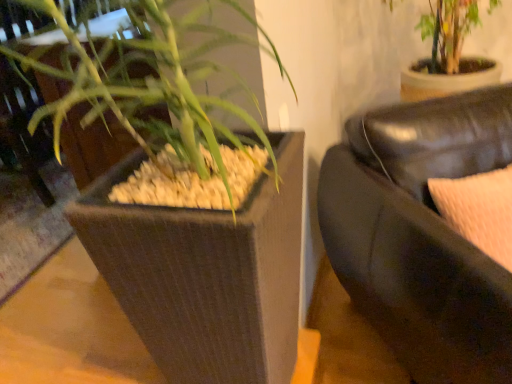
This screenshot has width=512, height=384. What are the coordinates of `brown textured planter at left` in the screenshot? It's located at (206, 274).

Describe the element at coordinates (154, 99) in the screenshot. I see `green leafy plant at upper left` at that location.

The height and width of the screenshot is (384, 512). I want to click on brown textured planter at left, so click(x=206, y=274).

From a real-world perspective, is brown textured planter at left below green leafy plant at upper left?

Yes, from a real-world perspective, brown textured planter at left is beneath green leafy plant at upper left.

Is brown textured planter at left positioned behind green leafy plant at upper left?

Yes, it is behind green leafy plant at upper left.

Is brown textured planter at left far away from green leafy plant at upper left?

No, brown textured planter at left is not far away from green leafy plant at upper left.

Is brown textured planter at left next to black leather couch at right?

No.

Does brown textured planter at left lie in front of black leather couch at right?

No, the depth of brown textured planter at left is greater than that of black leather couch at right.

Who is bigger, brown textured planter at left or black leather couch at right?

black leather couch at right is bigger.

Does point (469, 275) appear closer or farther from the camera than point (83, 202)?

Point (469, 275) is positioned closer to the camera compared to point (83, 202).

In the image, is black leather couch at right positioned in front of or behind brown textured planter at left?

Clearly, black leather couch at right is in front of brown textured planter at left.

Is black leather couch at right located outside brown textured planter at left?

Yes, black leather couch at right is located beyond the bounds of brown textured planter at left.

Considering the positions of objects black leather couch at right and brown textured planter at left in the image provided, who is more to the left, black leather couch at right or brown textured planter at left?

Positioned to the left is brown textured planter at left.

Considering the points (460, 311) and (159, 99), which point is in front, point (460, 311) or point (159, 99)?

The point (159, 99) is closer to the camera.

Is black leather couch at right oriented away from green leafy plant at upper left?

black leather couch at right does not have its back to green leafy plant at upper left.

Between black leather couch at right and green leafy plant at upper left, which one appears on the right side from the viewer's perspective?

black leather couch at right.

How many degrees apart are the facing directions of black leather couch at right and green leafy plant at upper left?

The angular difference between black leather couch at right and green leafy plant at upper left is 35.8 degrees.

You are a GUI agent. You are given a task and a screenshot of the screen. Output one action in this format:
    pyautogui.click(x=<x>, y=<y>)
    Task: Click on the flowerpot behind the green leafy plant at upper left
    
    Given the screenshot: What is the action you would take?
    pyautogui.click(x=206, y=274)

Does green leafy plant at upper left have a greater width compared to brown textured planter at left?

In fact, green leafy plant at upper left might be narrower than brown textured planter at left.

From a real-world perspective, relative to brown textured planter at left, is green leafy plant at upper left vertically above or below?

Clearly, from a real-world perspective, green leafy plant at upper left is above brown textured planter at left.

Considering the relative sizes of green leafy plant at upper left and black leather couch at right in the image provided, is green leafy plant at upper left taller than black leather couch at right?

Yes.

From a real-world perspective, relative to black leather couch at right, is green leafy plant at upper left vertically above or below?

In terms of real-world spatial position, green leafy plant at upper left is above black leather couch at right.

Is black leather couch at right at the back of green leafy plant at upper left?

That's not correct — green leafy plant at upper left is not looking away from black leather couch at right.

What are the coordinates of `flowerpot located behind the green leafy plant at upper left` in the screenshot? It's located at (206, 274).

The height and width of the screenshot is (384, 512). I want to click on studio couch above the brown textured planter at left (from the image's perspective), so click(x=421, y=234).

Based on their spatial positions, is green leafy plant at upper left or black leather couch at right closer to brown textured planter at left?

green leafy plant at upper left lies closer to brown textured planter at left than the other object.

Looking at the image, which one is located further to black leather couch at right, green leafy plant at upper left or brown textured planter at left?

The object further to black leather couch at right is green leafy plant at upper left.

When comparing their distances from black leather couch at right, does brown textured planter at left or green leafy plant at upper left seem closer?

brown textured planter at left lies closer to black leather couch at right than the other object.

Based on their spatial positions, is black leather couch at right or green leafy plant at upper left closer to brown textured planter at left?

green leafy plant at upper left is closer to brown textured planter at left.

Considering their positions, is black leather couch at right positioned further to green leafy plant at upper left than brown textured planter at left?

Based on the image, black leather couch at right appears to be further to green leafy plant at upper left.

Considering their positions, is brown textured planter at left positioned further to green leafy plant at upper left than black leather couch at right?

Based on the image, black leather couch at right appears to be further to green leafy plant at upper left.

Locate an element on the screen. orchid located between brown textured planter at left and black leather couch at right in the left-right direction is located at coordinates (154, 99).